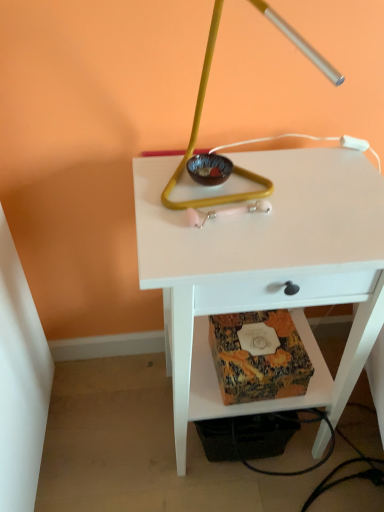
Where is `free spot below metallic gold lamp at center (from a real-world perspective)`? Image resolution: width=384 pixels, height=512 pixels. free spot below metallic gold lamp at center (from a real-world perspective) is located at coordinates (224, 208).